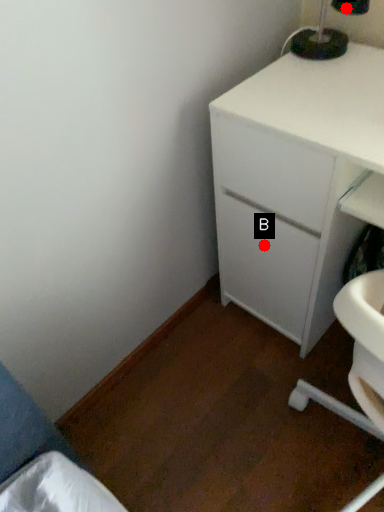
Question: Two points are circled on the image, labeled by A and B beside each circle. Among these points, which one is farthest from the camera?

Choices:
 (A) A is further
 (B) B is further

Answer: (B)